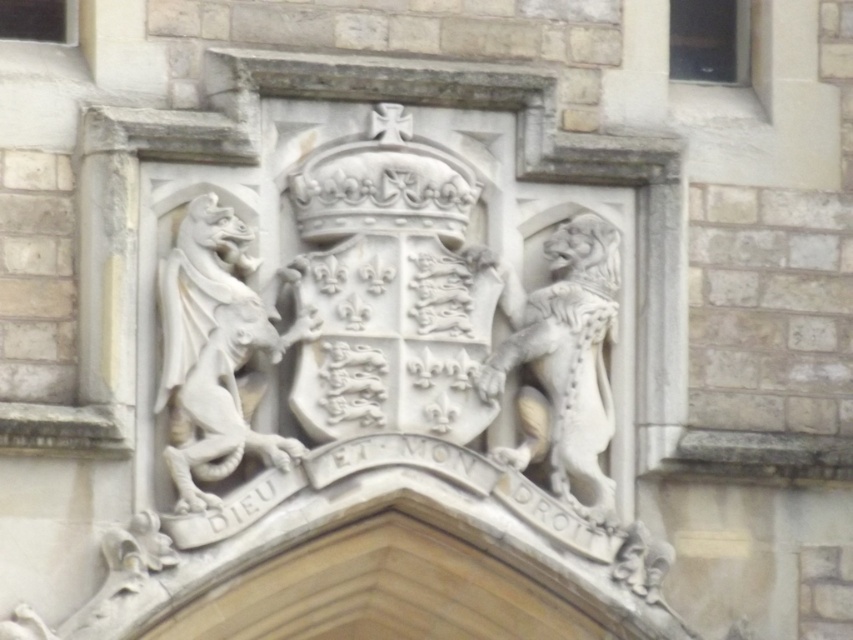
Is white stone gargoyle at upper left wider than white stone lion at right?

No, white stone gargoyle at upper left is not wider than white stone lion at right.

What do you see at coordinates (218, 349) in the screenshot? I see `white stone gargoyle at upper left` at bounding box center [218, 349].

Image resolution: width=853 pixels, height=640 pixels. What do you see at coordinates (218, 349) in the screenshot? I see `white stone gargoyle at upper left` at bounding box center [218, 349].

The image size is (853, 640). I want to click on white stone gargoyle at upper left, so (x=218, y=349).